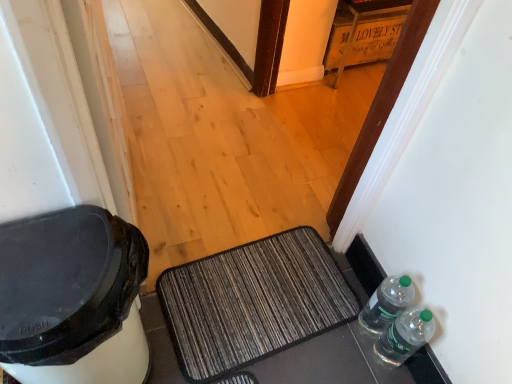
Where is `free space on the front side of clear plastic bottles at lower right, which ranks as the first bottle in back-to-front order`? This screenshot has height=384, width=512. free space on the front side of clear plastic bottles at lower right, which ranks as the first bottle in back-to-front order is located at coordinates [x=364, y=356].